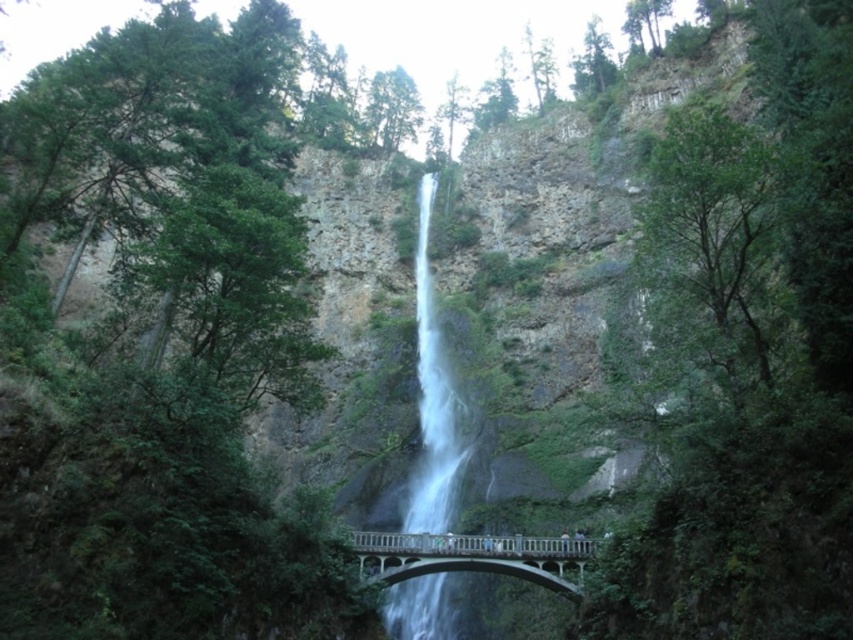
Question: Can you confirm if white frothy water at center is bigger than white concrete bridge at center?

Choices:
 (A) yes
 (B) no

Answer: (A)

Question: Which of the following is the farthest from the observer?

Choices:
 (A) (349, 538)
 (B) (416, 264)

Answer: (B)

Question: Observing the image, what is the correct spatial positioning of white frothy water at center in reference to white concrete bridge at center?

Choices:
 (A) below
 (B) above

Answer: (B)

Question: Observing the image, what is the correct spatial positioning of white frothy water at center in reference to white concrete bridge at center?

Choices:
 (A) above
 (B) below

Answer: (A)

Question: Which point appears closest to the camera in this image?

Choices:
 (A) (425, 536)
 (B) (399, 589)

Answer: (A)